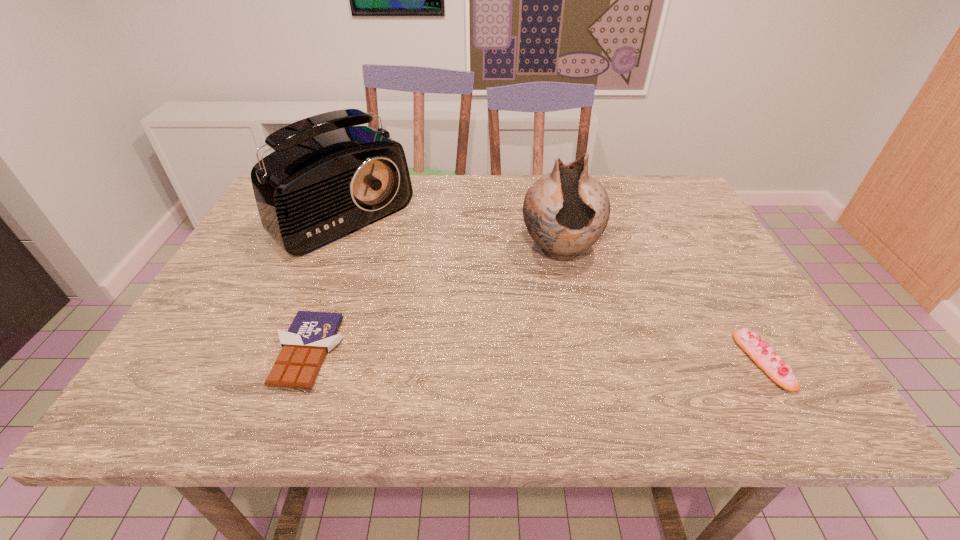
You are a GUI agent. You are given a task and a screenshot of the screen. Output one action in this format:
    pyautogui.click(x=<x>, y=<y>)
    Task: Click on the shortest object
    
    Given the screenshot: What is the action you would take?
    pyautogui.click(x=311, y=335)

Where is `the second shortest object`? This screenshot has width=960, height=540. the second shortest object is located at coordinates (759, 351).

Locate an element on the screen. This screenshot has height=540, width=960. the rightmost object is located at coordinates (759, 351).

Locate an element on the screen. radio receiver is located at coordinates (327, 178).

Identify the location of pottery. (565, 212).

The width and height of the screenshot is (960, 540). I want to click on vacant space situated 0.150m on the left of the rightmost object, so tap(666, 361).

In order to click on blank space located on the front-facing side of the radio receiver in this screenshot , I will do point(400,264).

Image resolution: width=960 pixels, height=540 pixels. I want to click on vacant space situated on the front-facing side of the radio receiver, so 469,319.

Image resolution: width=960 pixels, height=540 pixels. Identify the location of vacant space located 0.330m on the front-facing side of the radio receiver. (467, 317).

Find the location of a particular element. blank space located from the spout of the third object from left to right is located at coordinates (572, 318).